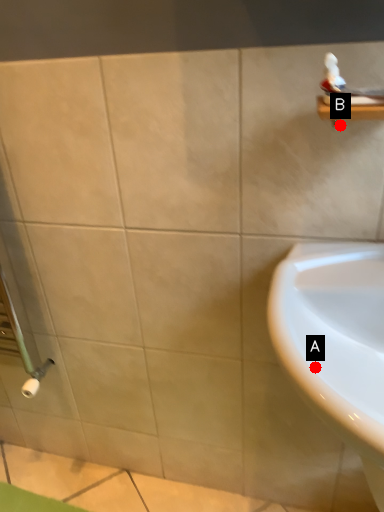
Question: Two points are circled on the image, labeled by A and B beside each circle. Among these points, which one is nearest to the camera?

Choices:
 (A) A is closer
 (B) B is closer

Answer: (A)